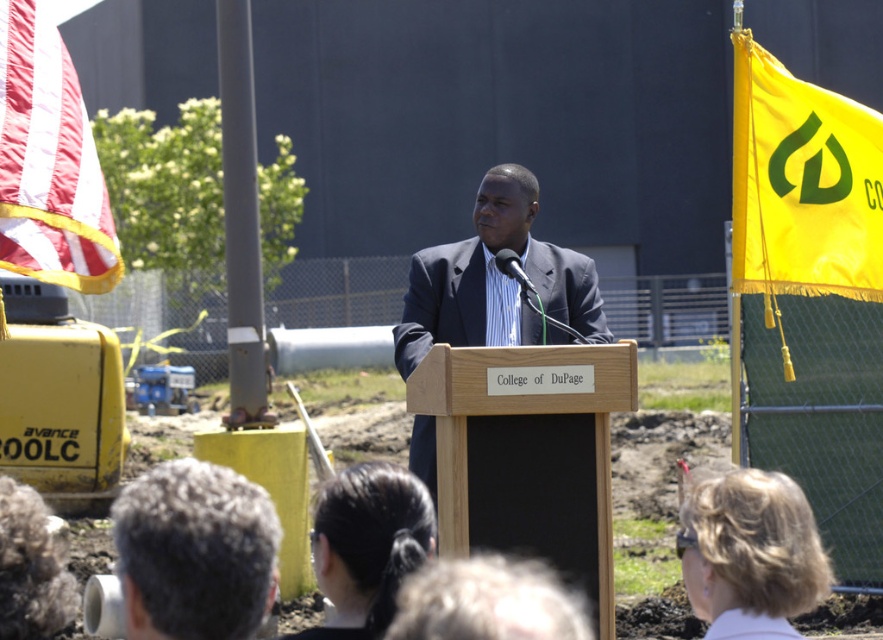
Question: Which point is closer to the camera?

Choices:
 (A) gray hair at center
 (B) red-white striped fabric at upper left
 (C) yellow fabric flag at upper right
 (D) dark blue suit at center

Answer: (A)

Question: In this image, where is yellow fabric flag at upper right located relative to blonde hair at lower right?

Choices:
 (A) left
 (B) right

Answer: (B)

Question: Which of the following is the farthest from the observer?

Choices:
 (A) (485, 240)
 (B) (136, 588)
 (C) (304, 625)

Answer: (C)

Question: Is gray hair at center wider than dark blue suit at center?

Choices:
 (A) no
 (B) yes

Answer: (B)

Question: Which is farther from the red-white striped fabric at upper left?

Choices:
 (A) dark blue suit at center
 (B) wooden podium at center

Answer: (A)

Question: Observing the image, what is the correct spatial positioning of gray hair at center in reference to dark blue suit at center?

Choices:
 (A) above
 (B) below

Answer: (A)